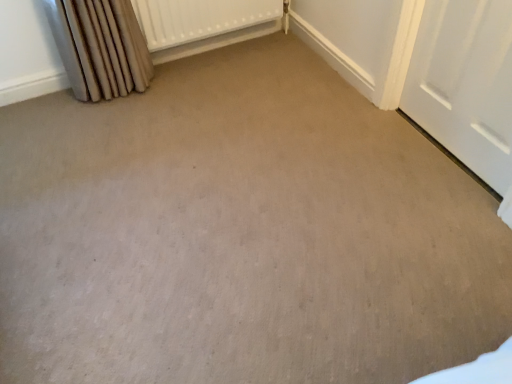
Question: Can you confirm if white matte door at right is positioned to the left of beige fabric curtain at left?

Choices:
 (A) no
 (B) yes

Answer: (A)

Question: Is white matte door at right thinner than beige fabric curtain at left?

Choices:
 (A) yes
 (B) no

Answer: (A)

Question: Is the position of white matte door at right more distant than that of beige fabric curtain at left?

Choices:
 (A) no
 (B) yes

Answer: (A)

Question: Is white matte door at right positioned far away from beige fabric curtain at left?

Choices:
 (A) yes
 (B) no

Answer: (A)

Question: From a real-world perspective, is white matte door at right positioned over beige fabric curtain at left based on gravity?

Choices:
 (A) no
 (B) yes

Answer: (B)

Question: Considering the positions of white textured radiator at upper center and white matte door at right in the image, is white textured radiator at upper center wider or thinner than white matte door at right?

Choices:
 (A) wide
 (B) thin

Answer: (A)

Question: Is white textured radiator at upper center inside or outside of white matte door at right?

Choices:
 (A) inside
 (B) outside

Answer: (B)

Question: Looking at the image, does white textured radiator at upper center seem bigger or smaller compared to white matte door at right?

Choices:
 (A) small
 (B) big

Answer: (B)

Question: From the image's perspective, is white textured radiator at upper center located above or below white matte door at right?

Choices:
 (A) below
 (B) above

Answer: (B)

Question: Choose the correct answer: Is white matte door at right inside white textured radiator at upper center or outside it?

Choices:
 (A) inside
 (B) outside

Answer: (B)

Question: Looking at their shapes, would you say white matte door at right is wider or thinner than white textured radiator at upper center?

Choices:
 (A) thin
 (B) wide

Answer: (A)

Question: From a real-world perspective, is white matte door at right positioned above or below white textured radiator at upper center?

Choices:
 (A) above
 (B) below

Answer: (A)

Question: In terms of height, does white matte door at right look taller or shorter compared to white textured radiator at upper center?

Choices:
 (A) short
 (B) tall

Answer: (B)

Question: Based on their sizes in the image, would you say white matte door at right is bigger or smaller than beige fabric curtain at left?

Choices:
 (A) small
 (B) big

Answer: (A)

Question: Considering their positions, is white matte door at right located in front of or behind beige fabric curtain at left?

Choices:
 (A) front
 (B) behind

Answer: (A)